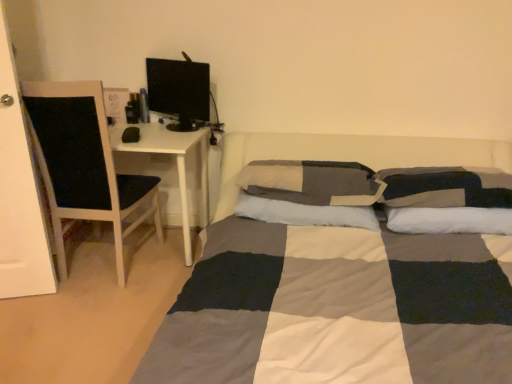
Question: Based on their sizes in the image, would you say black glossy computer monitor at upper left is bigger or smaller than checkered fabric pillow at center, marked as the 2th pillow in a left-to-right arrangement?

Choices:
 (A) big
 (B) small

Answer: (B)

Question: From the image's perspective, is black glossy computer monitor at upper left above or below checkered fabric pillow at center, placed as the 2th pillow when sorted from right to left?

Choices:
 (A) below
 (B) above

Answer: (B)

Question: Estimate the real-world distances between objects in this image. Which object is closer to the checkered fabric pillow at right, which is the third pillow in left-to-right order?

Choices:
 (A) black glossy computer monitor at upper left
 (B) checkered fabric pillow at center, marked as the 2th pillow in a left-to-right arrangement
 (C) soft cotton pillow at center, which is the 3th pillow in right-to-left order
 (D) white wood chair at left

Answer: (B)

Question: Which of these objects is positioned closest to the checkered fabric pillow at center, placed as the 2th pillow when sorted from right to left?

Choices:
 (A) checkered fabric pillow at right, the first pillow from the right
 (B) soft cotton pillow at center, which is the 3th pillow in right-to-left order
 (C) white wood chair at left
 (D) black glossy computer monitor at upper left

Answer: (B)